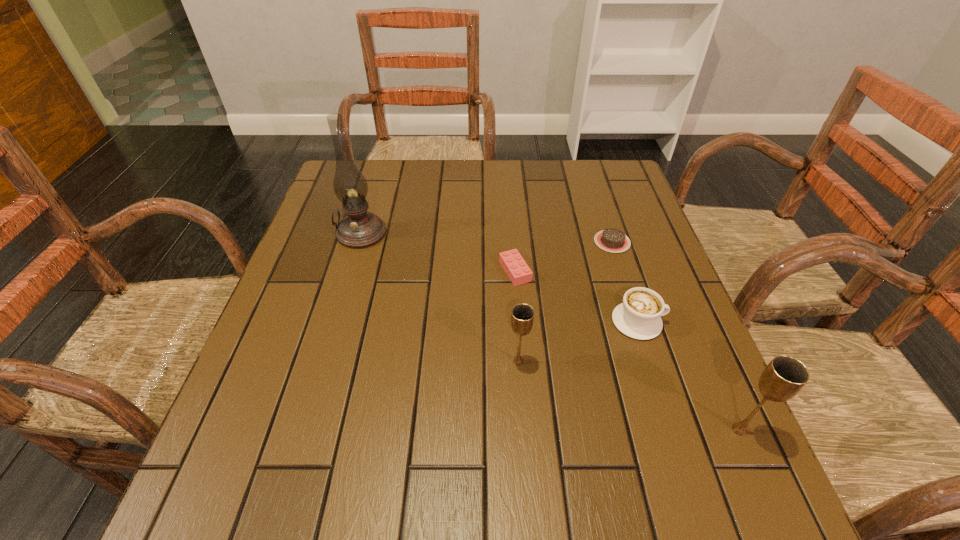
Locate an element on the screen. This screenshot has height=540, width=960. free space between the chocolate cake and the tallest object is located at coordinates (487, 238).

You are a GUI agent. You are given a task and a screenshot of the screen. Output one action in this format:
    pyautogui.click(x=<x>, y=<y>)
    Task: Click on the free space that is in between the Lego and the shortest object
    Image resolution: width=960 pixels, height=540 pixels.
    Given the screenshot: What is the action you would take?
    pyautogui.click(x=564, y=256)

Locate an element on the screen. The width and height of the screenshot is (960, 540). free space between the fifth tallest object and the nearer chalice is located at coordinates (627, 350).

You are a GUI agent. You are given a task and a screenshot of the screen. Output one action in this format:
    pyautogui.click(x=<x>, y=<y>)
    Task: Click on the vacant space that is in between the chocolate cake and the shorter chalice
    This screenshot has width=960, height=540.
    Given the screenshot: What is the action you would take?
    click(565, 302)

What are the coordinates of `free space between the oil lamp and the third farthest object` in the screenshot? It's located at (438, 252).

At what (x,y) coordinates should I click in order to perform the action: click on vacant point located between the shorter chalice and the shortest object. Please return your answer as a coordinate pair (x, y). Looking at the image, I should click on (565, 302).

Select which object appears as the closest to the leftmost object. Please provide its 2D coordinates. Your answer should be formatted as a tuple, i.e. [(x, y)], where the tuple contains the x and y coordinates of a point satisfying the conditions above.

[(518, 271)]

Locate an element on the screen. This screenshot has width=960, height=540. object that is the second closest to the shortest object is located at coordinates (518, 271).

The height and width of the screenshot is (540, 960). I want to click on vacant space that satisfies the following two spatial constraints: 1. to the right of the nearest object's handle; 2. on the right side of the third nearest object, so click(x=673, y=430).

Where is `free region that satisfies the following two spatial constraints: 1. to the right of the fourth farthest object's handle; 2. on the left side of the right chalice`? The image size is (960, 540). free region that satisfies the following two spatial constraints: 1. to the right of the fourth farthest object's handle; 2. on the left side of the right chalice is located at coordinates (673, 430).